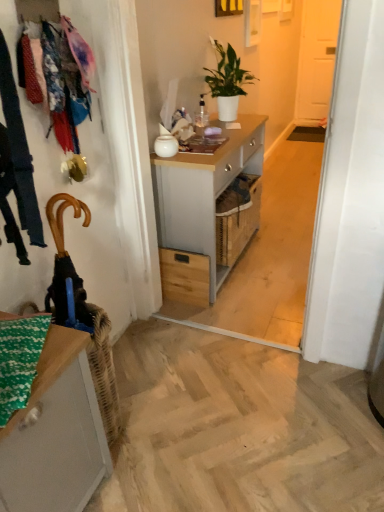
What do you see at coordinates (56, 434) in the screenshot? This screenshot has height=512, width=384. I see `matte gray cabinet at lower left` at bounding box center [56, 434].

You are a GUI agent. You are given a task and a screenshot of the screen. Output one action in this format:
    pyautogui.click(x=<x>, y=<y>)
    Task: Click on the white matte door at upper right
    This screenshot has width=384, height=512.
    Given the screenshot: What is the action you would take?
    pyautogui.click(x=316, y=58)

Image resolution: width=384 pixels, height=512 pixels. Find the location of `white matte plant at center`. white matte plant at center is located at coordinates (227, 81).

The image size is (384, 512). I want to click on white glossy vase at center, so click(166, 146).

Is floral fabric clothesline at left further to camera compared to white matte plant at center?

That is False.

From the image's perspective, which one is positioned lower, floral fabric clothesline at left or white matte plant at center?

floral fabric clothesline at left appears lower in the image.

From a real-world perspective, is floral fabric clothesline at left above or below white matte plant at center?

floral fabric clothesline at left is above white matte plant at center.

Based on their positions, is floral fabric clothesline at left located to the left or right of white matte plant at center?

From the image, it's evident that floral fabric clothesline at left is to the left of white matte plant at center.

Which point is more distant from viewer, [61,90] or [172,151]?

→ The point [172,151] is behind.

Which of these two, floral fabric clothesline at left or white glossy vase at center, stands taller?

Standing taller between the two is floral fabric clothesline at left.

Identify the location of clothesline to the left of white glossy vase at center. This screenshot has width=384, height=512. (66, 80).

How many degrees apart are the facing directions of floral fabric clothesline at left and white glossy vase at center?

They differ by 6.86 degrees in their facing directions.

Considering the relative sizes of white glossy vase at center and white matte plant at center in the image provided, is white glossy vase at center bigger than white matte plant at center?

Incorrect, white glossy vase at center is not larger than white matte plant at center.

From the image's perspective, is white glossy vase at center above or below white matte plant at center?

From the image's perspective, white glossy vase at center appears below white matte plant at center.

What's the angular difference between white glossy vase at center and white matte plant at center's facing directions?

There is a 2.16-degree angle between the facing directions of white glossy vase at center and white matte plant at center.

From the picture: Is white glossy vase at center in contact with white matte plant at center?

white glossy vase at center and white matte plant at center are clearly separated.

Can floral fabric clothesline at left be found inside white matte plant at center?

No, floral fabric clothesline at left is not inside white matte plant at center.

Does white matte plant at center appear on the left side of floral fabric clothesline at left?

In fact, white matte plant at center is to the right of floral fabric clothesline at left.

Who is bigger, white matte plant at center or floral fabric clothesline at left?

white matte plant at center is bigger.

From a real-world perspective, does white matte plant at center sit lower than floral fabric clothesline at left?

Correct, in the physical world, white matte plant at center is lower than floral fabric clothesline at left.

Where is `vase in front of the wooden drawer at center`? vase in front of the wooden drawer at center is located at coordinates (166, 146).

Could you tell me if white glossy vase at center is turned towards wooden drawer at center?

No, white glossy vase at center does not turn towards wooden drawer at center.

Consider the image. From the image's perspective, is white glossy vase at center positioned above or below wooden drawer at center?

white glossy vase at center is situated higher than wooden drawer at center in the image.

The height and width of the screenshot is (512, 384). In order to click on desk located on the right of white glossy vase at center in this screenshot , I will do `click(202, 199)`.

From a real-world perspective, does light gray wood desk at center stand above white glossy vase at center?

No.

Looking at this image, is light gray wood desk at center looking in the opposite direction of white glossy vase at center?

No.

Which object is closer to the camera taking this photo, velvet blue coat at left or white matte door at upper right?

velvet blue coat at left is more forward.

From the image's perspective, is velvet blue coat at left below white matte door at upper right?

Yes, from the image's perspective, velvet blue coat at left is below white matte door at upper right.

Considering the sizes of objects velvet blue coat at left and white matte door at upper right in the image provided, who is shorter, velvet blue coat at left or white matte door at upper right?

Standing shorter between the two is velvet blue coat at left.

Is velvet blue coat at left oriented away from white matte door at upper right?

velvet blue coat at left is not turned away from white matte door at upper right.

Find the location of a particular element. Image resolution: width=384 pixels, height=512 pixels. clothesline on the left of white matte plant at center is located at coordinates (66, 80).

The height and width of the screenshot is (512, 384). Find the location of `vase behind the floral fabric clothesline at left`. vase behind the floral fabric clothesline at left is located at coordinates (166, 146).

Based on their spatial positions, is white glossy vase at center or floral fabric clothesline at left closer to wooden drawer at center?

Among the two, white glossy vase at center is located nearer to wooden drawer at center.

Estimate the real-world distances between objects in this image. Which object is closer to velvet blue coat at left, white glossy vase at center or matte gray cabinet at lower left?

matte gray cabinet at lower left.

Looking at the image, which one is located closer to floral fabric clothesline at left, white glossy vase at center or white matte plant at center?

white glossy vase at center.

Estimate the real-world distances between objects in this image. Which object is closer to velvet blue coat at left, white matte door at upper right or floral fabric clothesline at left?

floral fabric clothesline at left is positioned closer to the anchor velvet blue coat at left.

Based on their spatial positions, is floral fabric clothesline at left or matte gray cabinet at lower left further from white matte door at upper right?

matte gray cabinet at lower left is further to white matte door at upper right.

Looking at the image, which one is located closer to white glossy vase at center, white matte door at upper right or matte gray cabinet at lower left?

The object closer to white glossy vase at center is matte gray cabinet at lower left.

From the image, which object appears to be nearer to floral fabric clothesline at left, velvet blue coat at left or light gray wood desk at center?

velvet blue coat at left is positioned closer to the anchor floral fabric clothesline at left.

Based on their spatial positions, is wooden drawer at center or white glossy vase at center further from white matte plant at center?

Based on the image, wooden drawer at center appears to be further to white matte plant at center.

Locate an element on the screen. The height and width of the screenshot is (512, 384). clothesline that lies between white matte plant at center and matte gray cabinet at lower left from top to bottom is located at coordinates (66, 80).

Where is `desk between matte gray cabinet at lower left and white glossy vase at center along the z-axis`? This screenshot has height=512, width=384. desk between matte gray cabinet at lower left and white glossy vase at center along the z-axis is located at coordinates (202, 199).

Where is `cabinetry positioned between velvet blue coat at left and wooden drawer at center from near to far`? This screenshot has width=384, height=512. cabinetry positioned between velvet blue coat at left and wooden drawer at center from near to far is located at coordinates (56, 434).

Locate an element on the screen. The image size is (384, 512). vase between white matte plant at center and wooden drawer at center vertically is located at coordinates (166, 146).